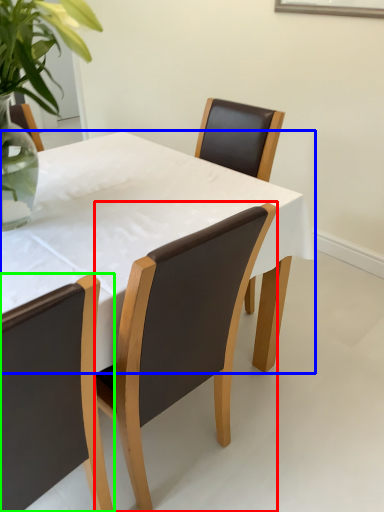
Question: Which object is positioned farthest from chair (highlighted by a red box)? Select from kitchen & dining room table (highlighted by a blue box) and chair (highlighted by a green box).

Choices:
 (A) kitchen & dining room table
 (B) chair

Answer: (A)